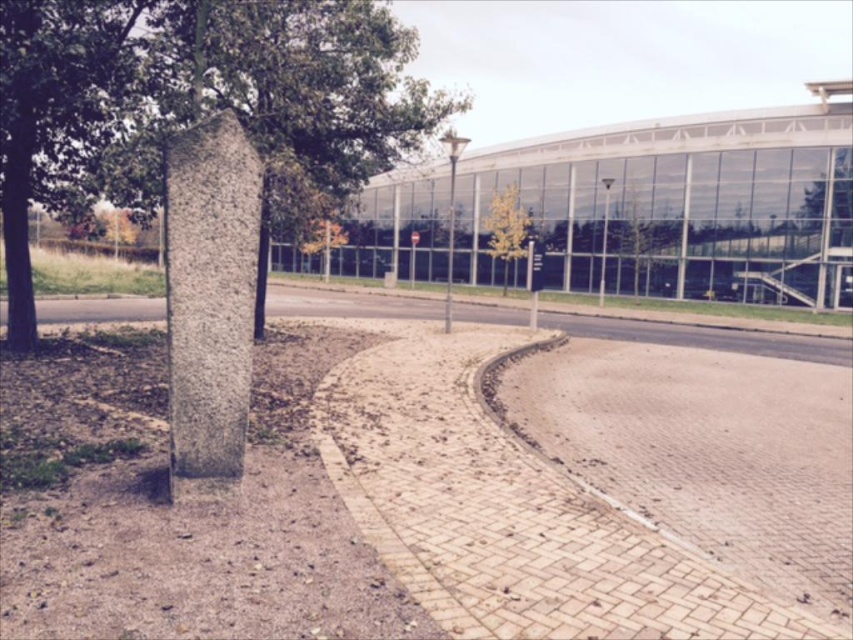
Is brick paved sidewalk at center thinner than green leafy tree at upper right?

In fact, brick paved sidewalk at center might be wider than green leafy tree at upper right.

Does brick paved sidewalk at center appear on the left side of green leafy tree at upper right?

Indeed, brick paved sidewalk at center is positioned on the left side of green leafy tree at upper right.

Is point (683, 616) farther from camera compared to point (845, 244)?

No, it is not.

You are a GUI agent. You are given a task and a screenshot of the screen. Output one action in this format:
    pyautogui.click(x=<x>, y=<y>)
    Task: Click on the brick paved sidewalk at center
    
    Given the screenshot: What is the action you would take?
    click(x=440, y=490)

Is green textured stone at left further to the viewer compared to granite column at center?

Yes.

Is point (264, 116) positioned behind point (231, 342)?

That is True.

Identify the location of green textured stone at left. Image resolution: width=853 pixels, height=640 pixels. (196, 100).

Is point (228, 188) more distant than point (508, 218)?

That is False.

Is granite column at center shorter than yellow-green foliage at center?

No.

At what (x,y) coordinates should I click in order to perform the action: click on granite column at center. Please return your answer as a coordinate pair (x, y). The image size is (853, 640). Looking at the image, I should click on (209, 301).